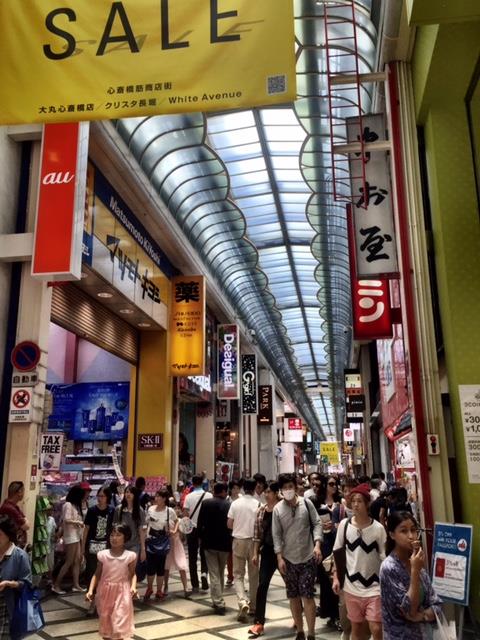
The height and width of the screenshot is (640, 480). What are the coordinates of `skylight` in the screenshot? It's located at (283, 186).